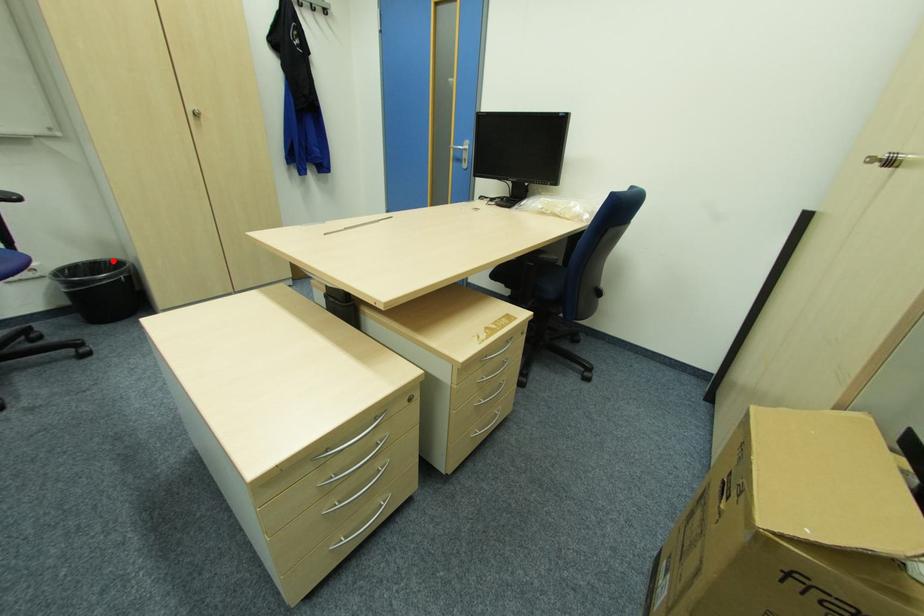
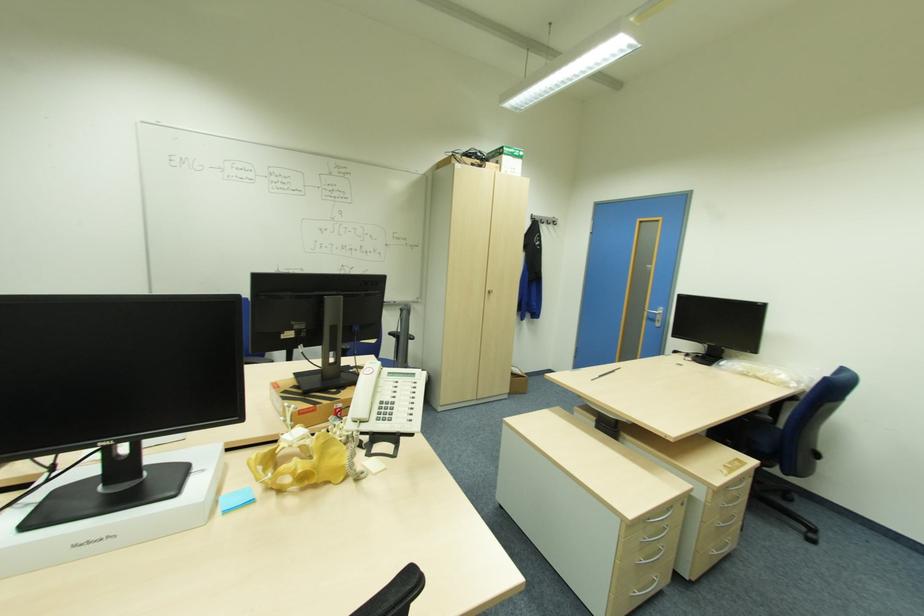
Question: I am providing you with two images of the same scene from different viewpoints. A red point is marked on the first image. Can you still see the location of the red point in image 2?

Choices:
 (A) Yes
 (B) No

Answer: (B)